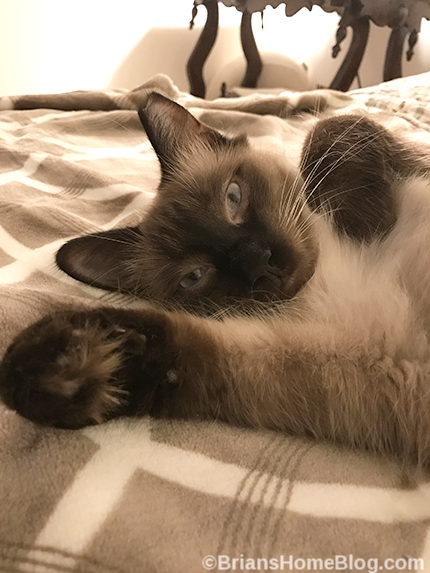
I want to click on brown squares on blanket, so click(x=177, y=517), click(x=24, y=453), click(x=36, y=204), click(x=112, y=171).